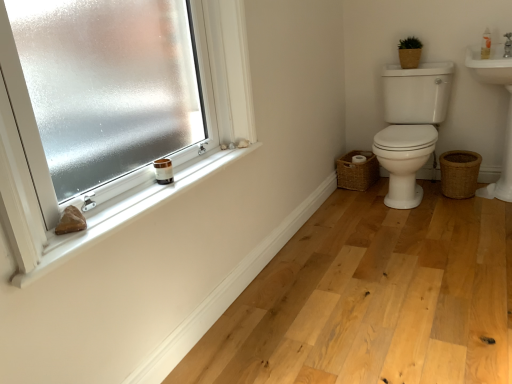
Question: Is woven brown basket at lower right, acting as the 2th basket starting from the bottom, in front of or behind natural wood floor at lower center in the image?

Choices:
 (A) front
 (B) behind

Answer: (B)

Question: Would you say woven brown basket at lower right, which appears as the first basket when viewed from the left, is inside or outside natural wood floor at lower center?

Choices:
 (A) inside
 (B) outside

Answer: (B)

Question: Considering the real-world distances, which object is closest to the white matte window sill at upper left?

Choices:
 (A) white glossy toilet at right
 (B) woven brown basket at lower right, acting as the 2th basket starting from the bottom
 (C) natural wood floor at lower center
 (D) woven brown basket at lower right, placed as the 1th basket when sorted from right to left
 (E) brown woven basket at upper right, which ranks as the 2th basket in left-to-right order

Answer: (C)

Question: Which object is positioned closest to the white matte window sill at upper left?

Choices:
 (A) white plastic bottle at upper right
 (B) woven brown basket at lower right, placed as the 1th basket when sorted from right to left
 (C) frosted glass window at upper left
 (D) woven brown basket at lower right, which ranks as the 2th basket in top-to-bottom order
 (E) natural wood floor at lower center

Answer: (E)